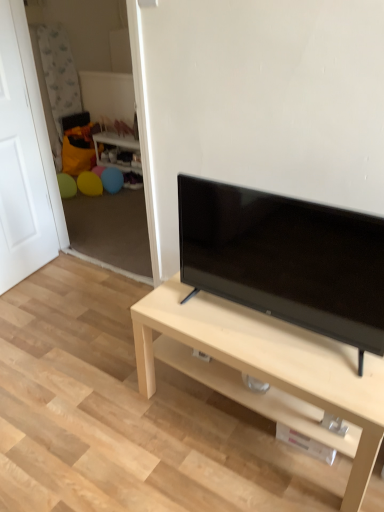
What are the coordinates of `vacant space underneath white matte door at left (from a real-world perspective)` in the screenshot? It's located at (36, 275).